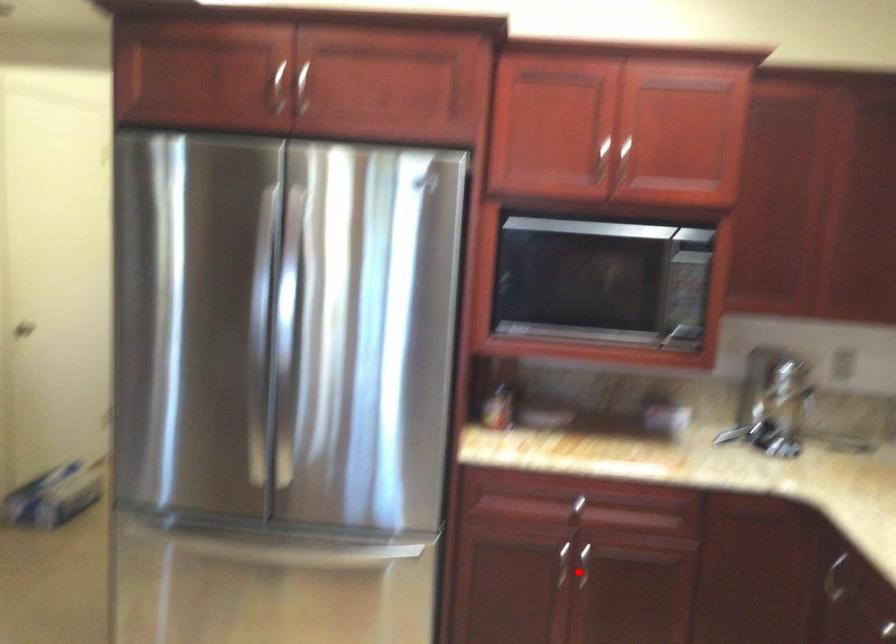
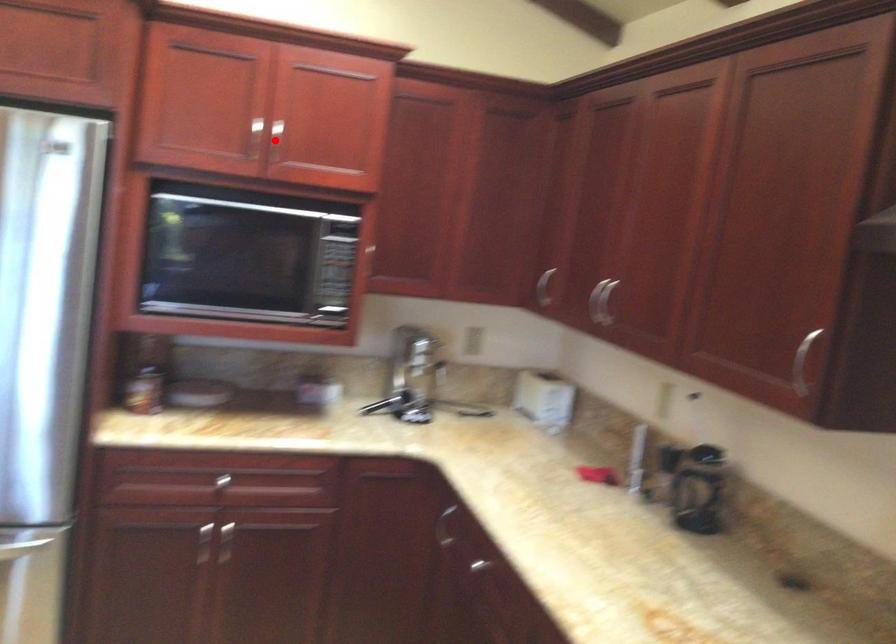
I am providing you with two images of the same scene from different viewpoints. A red point is marked on the first image and another point is marked on the second image. Does the point marked in image1 correspond to the same location as the one in image2?

No